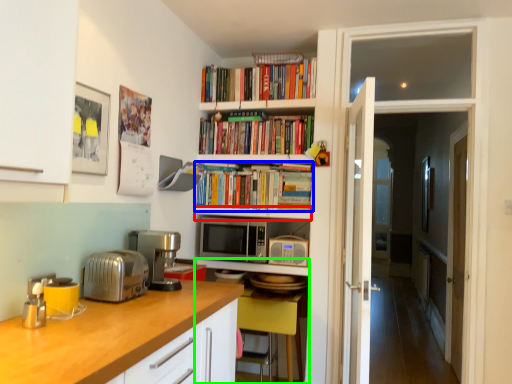
Question: Based on their relative distances, which object is nearer to shelf (highlighted by a red box)? Choose from book (highlighted by a blue box) and computer desk (highlighted by a green box).

Choices:
 (A) book
 (B) computer desk

Answer: (A)